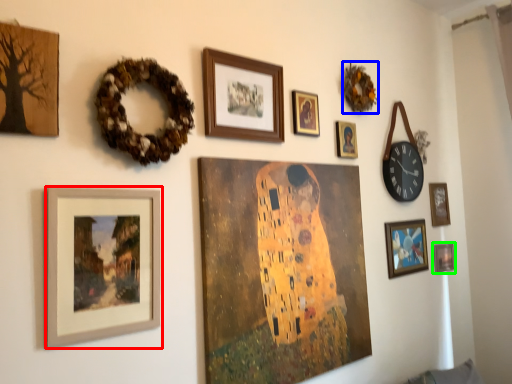
Question: Considering the real-world distances, which object is farthest from picture frame (highlighted by a red box)? decor (highlighted by a blue box) or picture frame (highlighted by a green box)?

Choices:
 (A) decor
 (B) picture frame

Answer: (B)